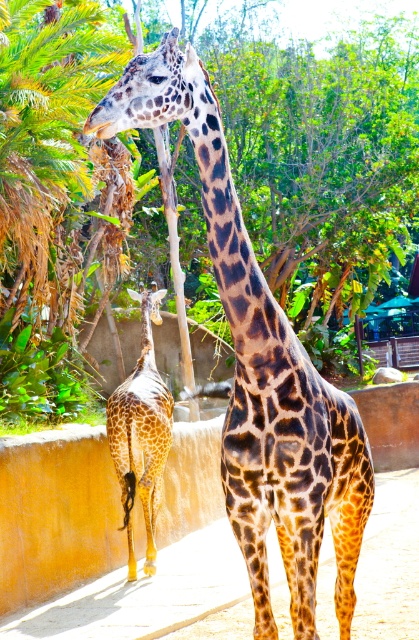
Question: Which point appears farthest from the camera in this image?

Choices:
 (A) [282, 157]
 (B) [162, 397]

Answer: (A)

Question: Is the position of spotted fur giraffe at center less distant than that of spotted fur giraffe at lower left?

Choices:
 (A) no
 (B) yes

Answer: (B)

Question: Does green leafy tree at upper left appear on the right side of spotted fur giraffe at lower left?

Choices:
 (A) no
 (B) yes

Answer: (B)

Question: Estimate the real-world distances between objects in this image. Which object is farther from the green leafy tree at upper left?

Choices:
 (A) spotted fur giraffe at lower left
 (B) spotted fur giraffe at center

Answer: (B)

Question: Where is green leafy tree at upper left located in relation to spotted fur giraffe at center in the image?

Choices:
 (A) left
 (B) right

Answer: (B)

Question: Which point is farther from the camera taking this photo?

Choices:
 (A) (390, 64)
 (B) (152, 538)
 (C) (341, 596)

Answer: (A)